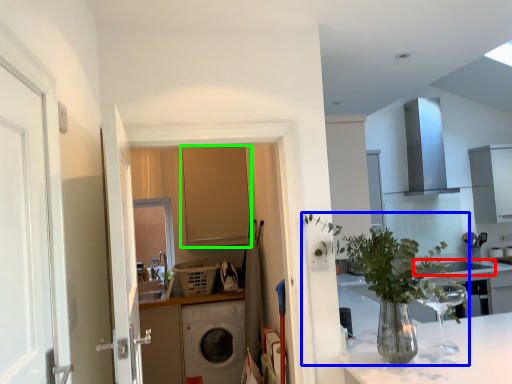
Question: Estimate the real-world distances between objects in this image. Which object is closer to sink (highlighted by a red box), houseplant (highlighted by a blue box) or cabinetry (highlighted by a green box)?

Choices:
 (A) houseplant
 (B) cabinetry

Answer: (B)